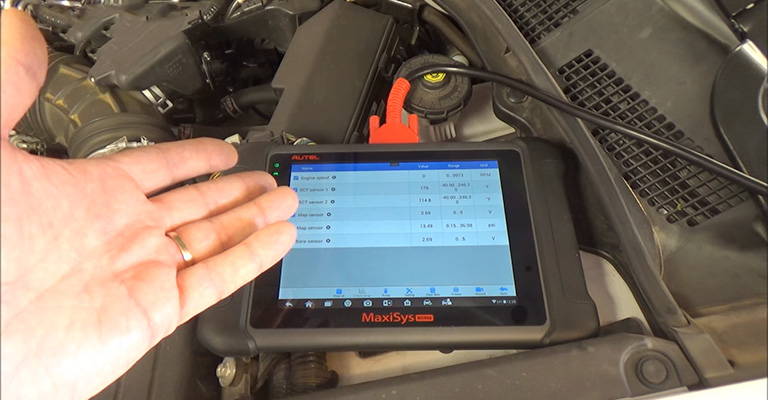
What are the coordinates of `cable` in the screenshot? It's located at (471, 67).